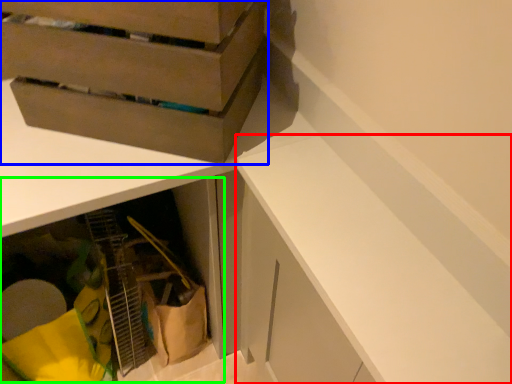
Question: Which object is positioned farthest from cabinetry (highlighted by a red box)? Select from cardboard box (highlighted by a blue box) and cabinetry (highlighted by a green box).

Choices:
 (A) cardboard box
 (B) cabinetry

Answer: (B)